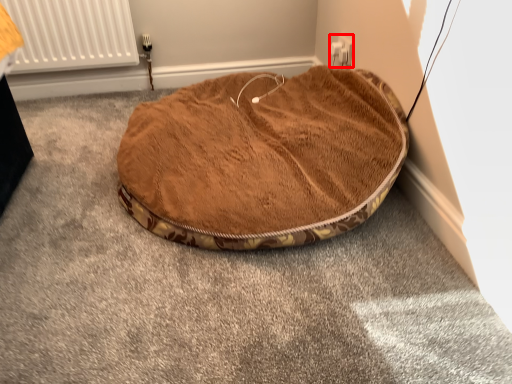
Question: From the image's perspective, what is the correct spatial relationship of electric outlet (annotated by the red box) in relation to dog bed?

Choices:
 (A) below
 (B) above

Answer: (B)